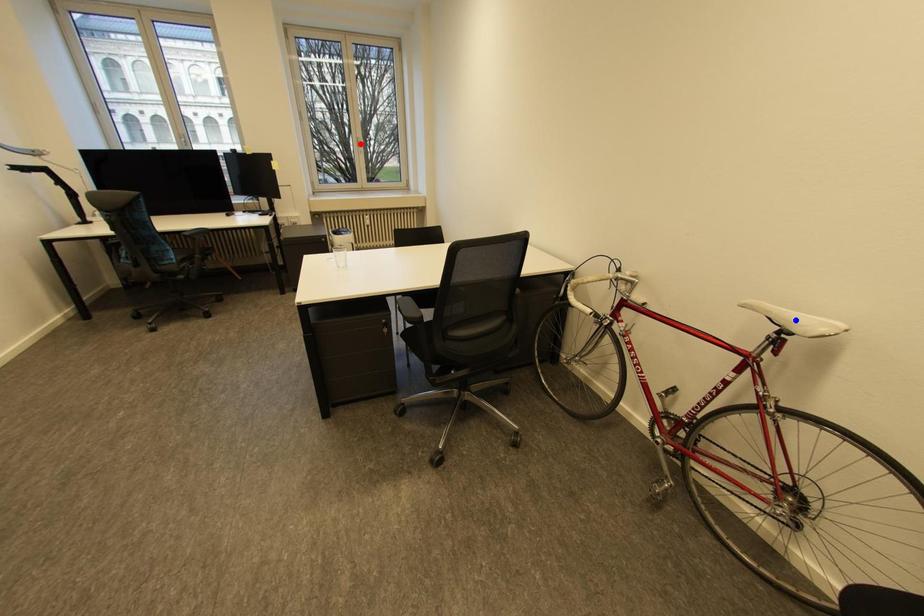
Question: Which of the two points in the image is closer to the camera?

Choices:
 (A) Blue point is closer.
 (B) Red point is closer.

Answer: (A)